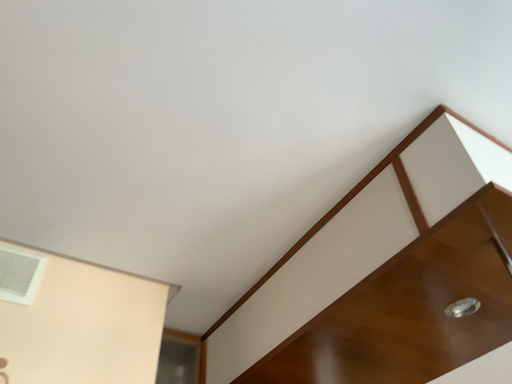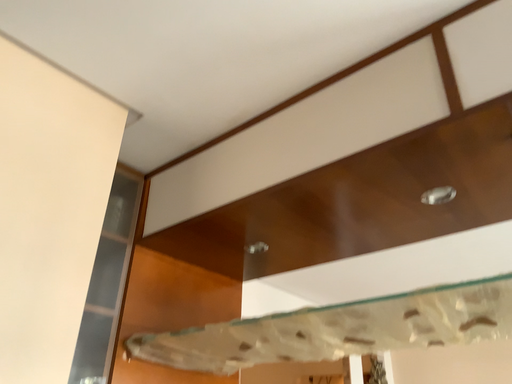
Question: Which way did the camera rotate in the video?

Choices:
 (A) rotated downward
 (B) rotated upward

Answer: (A)